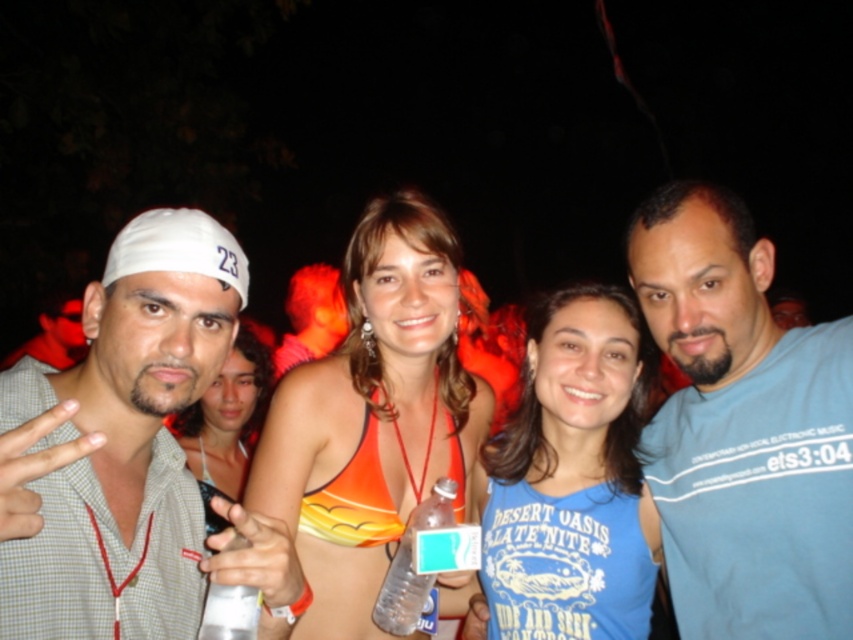
Question: Where is orange fabric bikini top at center located in relation to clear plastic bottle at center in the image?

Choices:
 (A) right
 (B) left

Answer: (B)

Question: Which of the following is the farthest from the observer?

Choices:
 (A) pyautogui.click(x=396, y=621)
 (B) pyautogui.click(x=142, y=225)

Answer: (A)

Question: Is blue cotton tank top at center closer to camera compared to orange fabric dress at center?

Choices:
 (A) yes
 (B) no

Answer: (A)

Question: Is blue cotton t-shirt at right in front of orange fabric dress at center?

Choices:
 (A) no
 (B) yes

Answer: (B)

Question: Which point is closer to the camera taking this photo?

Choices:
 (A) (434, 516)
 (B) (57, 404)
 (C) (543, 465)
 (D) (746, 467)

Answer: (B)

Question: Considering the real-world distances, which object is closest to the white plastic cup at lower left?

Choices:
 (A) orange fabric bikini top at center
 (B) orange fabric dress at center
 (C) blue cotton t-shirt at right
 (D) blue cotton tank top at center

Answer: (A)